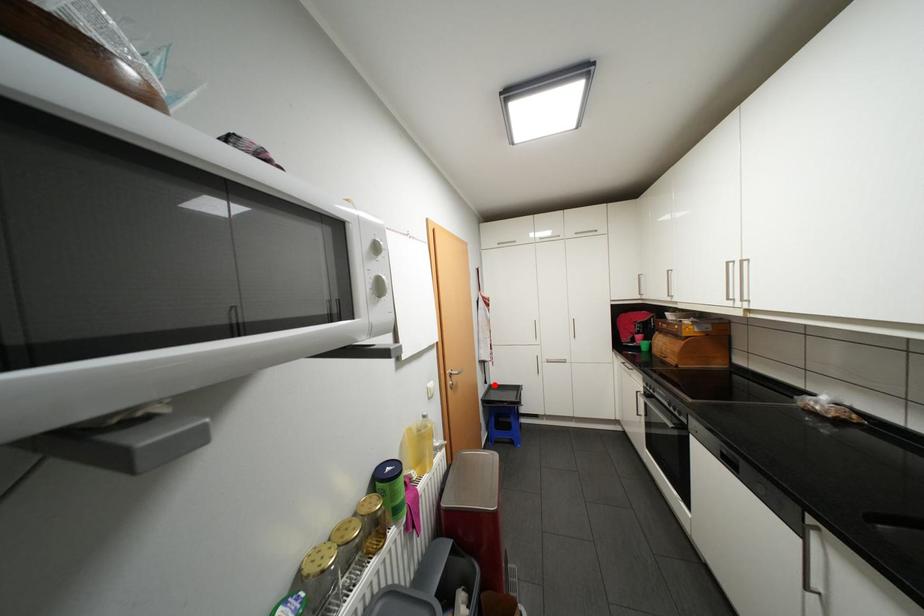
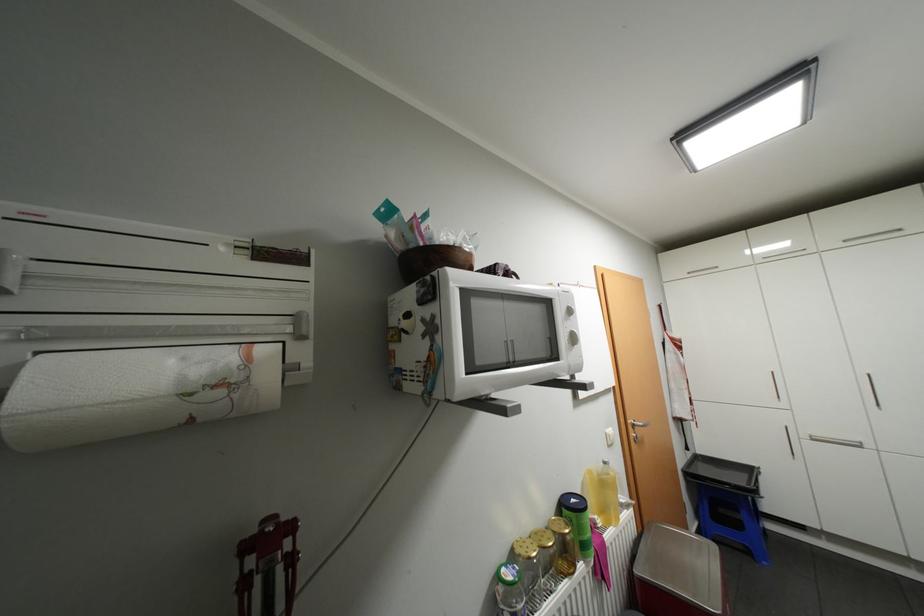
Where in the second image is the point corresponding to the highlighted location from the first image?

(697, 453)